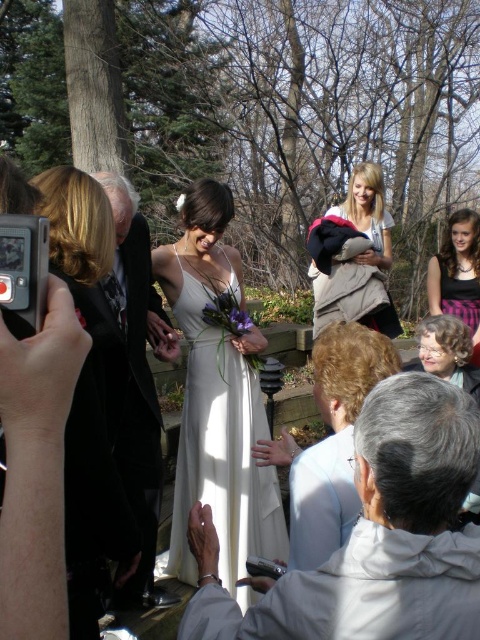
Question: From the image, what is the correct spatial relationship of white satin dress at center in relation to black leather shoes at center?

Choices:
 (A) left
 (B) right

Answer: (B)

Question: In this image, where is white satin dress at left located relative to white cotton shirt at upper center?

Choices:
 (A) right
 (B) left

Answer: (B)

Question: Which point is farther to the camera?

Choices:
 (A) white cotton shirt at upper center
 (B) black leather shoes at center
 (C) white satin dress at center
 (D) matte white dress at center

Answer: (A)

Question: Can you confirm if white satin dress at center is positioned to the right of white cotton shirt at upper center?

Choices:
 (A) no
 (B) yes

Answer: (A)

Question: Which of the following is the farthest from the observer?

Choices:
 (A) (445, 339)
 (B) (451, 250)

Answer: (B)

Question: Which point is closer to the camera?

Choices:
 (A) white cotton shirt at upper center
 (B) white satin jacket at lower right

Answer: (B)